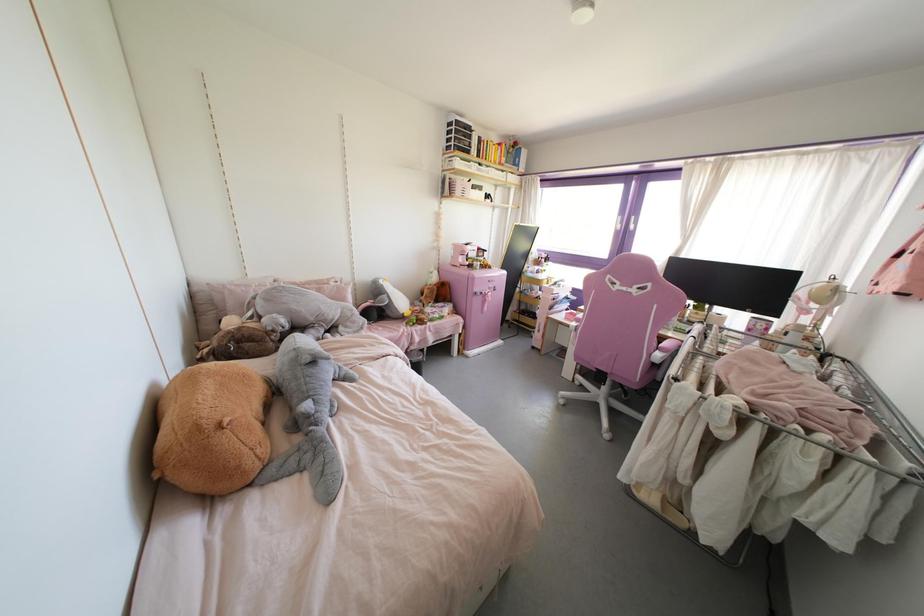
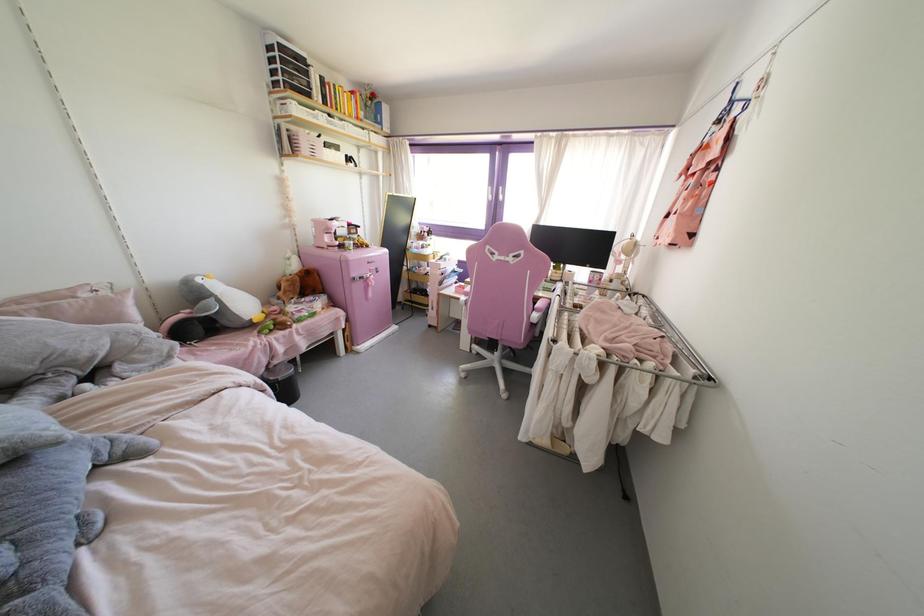
Question: The camera is either moving clockwise (left) or counter-clockwise (right) around the object. The first image is from the beginning of the video and the second image is from the end. Is the camera moving left or right when shooting the video?

Choices:
 (A) Left
 (B) Right

Answer: (A)